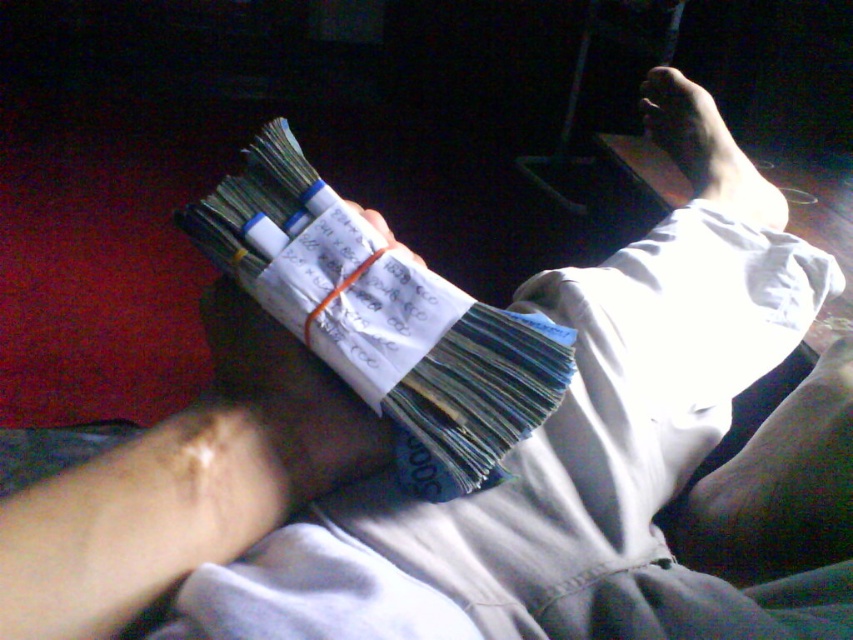
Question: Which of the following is the closest to the observer?

Choices:
 (A) smooth skin foot at upper right
 (B) white paper money at center

Answer: (B)

Question: From the image, what is the correct spatial relationship of white paper money at center in relation to smooth skin foot at upper right?

Choices:
 (A) left
 (B) right

Answer: (A)

Question: Is white paper money at center below smooth skin foot at upper right?

Choices:
 (A) no
 (B) yes

Answer: (B)

Question: From the image, what is the correct spatial relationship of white paper money at center in relation to smooth skin foot at upper right?

Choices:
 (A) right
 (B) left

Answer: (B)

Question: Which point appears closest to the camera in this image?

Choices:
 (A) (764, 208)
 (B) (456, 468)

Answer: (B)